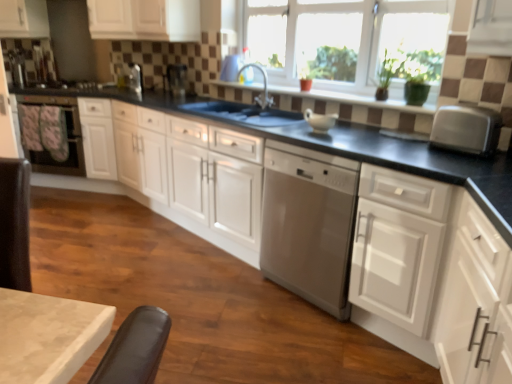
Question: Can we say white matte cabinet at upper left, which is the second cabinetry from left to right, lies outside metallic silver toaster at upper center, which appears as the third appliance when viewed from the back?

Choices:
 (A) no
 (B) yes

Answer: (B)

Question: From a real-world perspective, is white matte cabinet at upper left, which is the second cabinetry from left to right, physically above metallic silver toaster at upper center, arranged as the 1th appliance when viewed from the right?

Choices:
 (A) yes
 (B) no

Answer: (A)

Question: Considering the relative sizes of white matte cabinet at upper left, which is the second cabinetry from left to right, and metallic silver toaster at upper center, which is counted as the 3th appliance, starting from the left, in the image provided, is white matte cabinet at upper left, which is the second cabinetry from left to right, bigger than metallic silver toaster at upper center, which is counted as the 3th appliance, starting from the left,?

Choices:
 (A) no
 (B) yes

Answer: (B)

Question: Is white matte cabinet at upper left, which is the second cabinetry from left to right, to the right of metallic silver toaster at upper center, arranged as the 1th appliance when viewed from the right, from the viewer's perspective?

Choices:
 (A) no
 (B) yes

Answer: (A)

Question: From the image's perspective, does white matte cabinet at upper left, which is the second cabinetry from left to right, appear lower than metallic silver toaster at upper center, arranged as the 1th appliance when viewed from the right?

Choices:
 (A) no
 (B) yes

Answer: (A)

Question: Is white matte cabinet at upper left, which is the second cabinetry from left to right, not close to metallic silver toaster at upper center, arranged as the 1th appliance when viewed from the right?

Choices:
 (A) yes
 (B) no

Answer: (B)

Question: Is white matte cabinet at upper left, placed as the 4th cabinetry when sorted from right to left, oriented towards satin silver toaster at upper center, marked as the second appliance in a front-to-back arrangement?

Choices:
 (A) yes
 (B) no

Answer: (B)

Question: Is white matte cabinet at upper left, which is the first cabinetry in left-to-right order, looking in the opposite direction of satin silver toaster at upper center, the second appliance in the right-to-left sequence?

Choices:
 (A) no
 (B) yes

Answer: (A)

Question: Is white matte cabinet at upper left, placed as the 4th cabinetry when sorted from right to left, positioned far away from satin silver toaster at upper center, which is the second appliance in left-to-right order?

Choices:
 (A) no
 (B) yes

Answer: (A)

Question: From a real-world perspective, is white matte cabinet at upper left, placed as the 4th cabinetry when sorted from right to left, over satin silver toaster at upper center, marked as the second appliance in a front-to-back arrangement?

Choices:
 (A) no
 (B) yes

Answer: (B)

Question: Is the depth of white matte cabinet at upper left, which is the first cabinetry in left-to-right order, greater than that of satin silver toaster at upper center, which is the second appliance in left-to-right order?

Choices:
 (A) yes
 (B) no

Answer: (A)

Question: Is white matte cabinet at upper left, placed as the 4th cabinetry when sorted from right to left, directly adjacent to satin silver toaster at upper center, marked as the second appliance in a front-to-back arrangement?

Choices:
 (A) no
 (B) yes

Answer: (A)

Question: Does silver metallic toaster at right turn towards brown tile window sill at center?

Choices:
 (A) no
 (B) yes

Answer: (A)